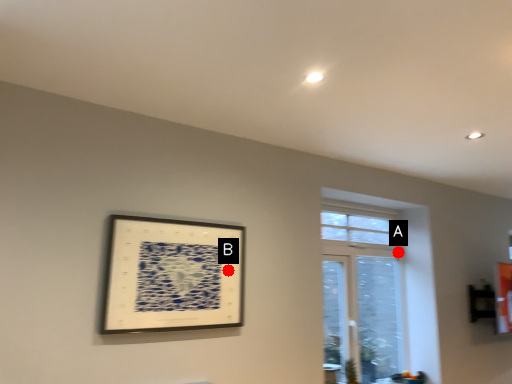
Question: Two points are circled on the image, labeled by A and B beside each circle. Which point is farther from the camera taking this photo?

Choices:
 (A) A is further
 (B) B is further

Answer: (A)